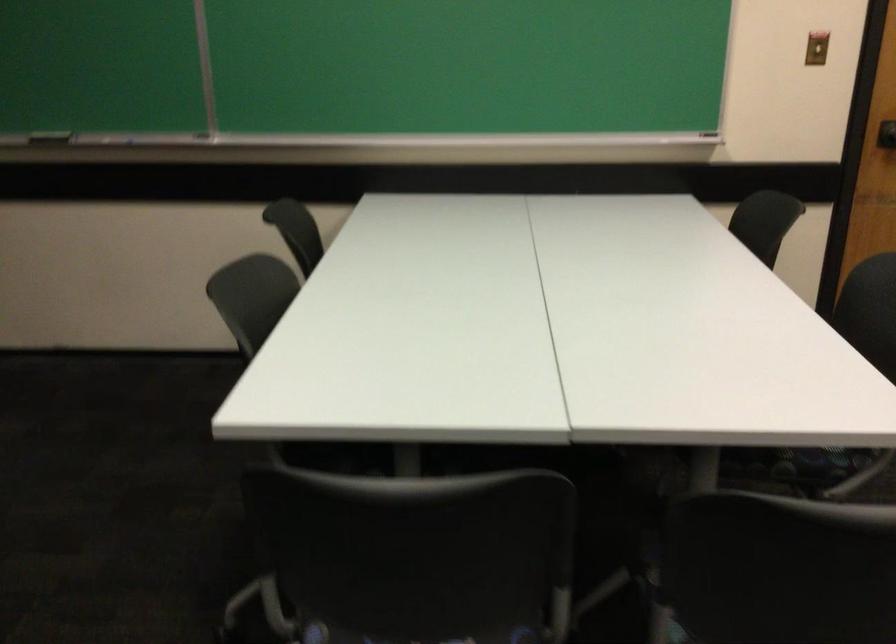
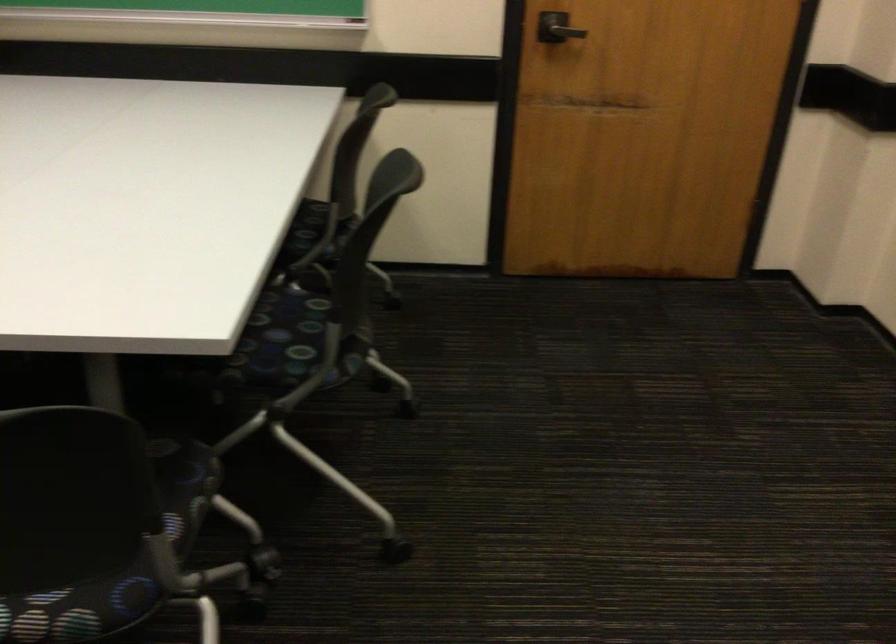
Question: The camera is either moving clockwise (left) or counter-clockwise (right) around the object. The first image is from the beginning of the video and the second image is from the end. Is the camera moving left or right when shooting the video?

Choices:
 (A) Left
 (B) Right

Answer: (A)